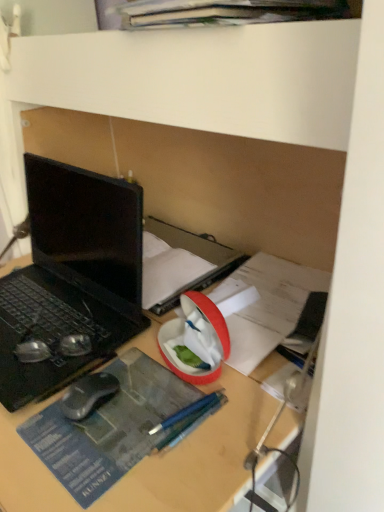
At what (x,y) coordinates should I click in order to perform the action: click on metallic blue pencil at center. Please return your answer as a coordinate pair (x, y). The image size is (384, 512). Looking at the image, I should click on (188, 419).

What is the approximate height of metallic blue pencil at center?

It is 3.09 centimeters.

What do you see at coordinates (194, 255) in the screenshot? This screenshot has width=384, height=512. I see `matte black book at center` at bounding box center [194, 255].

Measure the distance between point (70, 280) and camera.

Point (70, 280) and camera are 93.70 centimeters apart from each other.

Locate an element on the screen. The height and width of the screenshot is (512, 384). black rubberized mouse at lower left is located at coordinates (88, 395).

The width and height of the screenshot is (384, 512). What are the coordinates of `metallic blue pencil at center` in the screenshot? It's located at (188, 419).

From the image's perspective, is matte black book at center on top of black matte laptop at left?

No, from the image's perspective, matte black book at center is not on top of black matte laptop at left.

From a real-world perspective, is matte black book at center physically located above or below black matte laptop at left?

matte black book at center is below black matte laptop at left.

How much distance is there between matte black book at center and black matte laptop at left?

The distance of matte black book at center from black matte laptop at left is 8.84 inches.

Which is closer, (x=161, y=303) or (x=43, y=170)?

Point (x=161, y=303) appears to be closer to the viewer than point (x=43, y=170).

Does black rubberized mouse at lower left have a greater height compared to metallic blue pencil at center?

Indeed, black rubberized mouse at lower left has a greater height compared to metallic blue pencil at center.

Is black rubberized mouse at lower left looking in the opposite direction of metallic blue pencil at center?

No, black rubberized mouse at lower left is not facing the opposite direction of metallic blue pencil at center.

Which point is more distant from viewer, (80, 399) or (201, 421)?

The point (80, 399) is behind.

Do you think metallic blue pencil at center is within black rubberized mouse at lower left, or outside of it?

metallic blue pencil at center is not inside black rubberized mouse at lower left, it's outside.

Is metallic blue pencil at center taller or shorter than black rubberized mouse at lower left?

Considering their sizes, metallic blue pencil at center has less height than black rubberized mouse at lower left.

In terms of width, does metallic blue pencil at center look wider or thinner when compared to black rubberized mouse at lower left?

Clearly, metallic blue pencil at center has more width compared to black rubberized mouse at lower left.

Considering the points (194, 420) and (89, 386), which point is in front, point (194, 420) or point (89, 386)?

The point (194, 420) is more forward.

Is black matte laptop at left inside or outside of matte black book at center?

black matte laptop at left is not enclosed by matte black book at center.

Is black matte laptop at left oriented towards matte black book at center?

No, black matte laptop at left does not turn towards matte black book at center.

Is black matte laptop at left further to the viewer compared to matte black book at center?

No, black matte laptop at left is in front of matte black book at center.

In the scene shown: Considering the relative sizes of black matte laptop at left and matte black book at center in the image provided, is black matte laptop at left shorter than matte black book at center?

No.

Considering the relative sizes of black matte laptop at left and metallic blue pencil at center in the image provided, is black matte laptop at left taller than metallic blue pencil at center?

Indeed, black matte laptop at left has a greater height compared to metallic blue pencil at center.

Does black matte laptop at left have a smaller size compared to metallic blue pencil at center?

Incorrect, black matte laptop at left is not smaller in size than metallic blue pencil at center.

In the scene shown: Based on their positions, is black matte laptop at left located to the left or right of metallic blue pencil at center?

Based on their positions, black matte laptop at left is located to the left of metallic blue pencil at center.

Identify the location of pencil below the black matte laptop at left (from a real-world perspective). The image size is (384, 512). (188, 419).

Considering the relative positions of metallic blue pencil at center and black matte laptop at left in the image provided, is metallic blue pencil at center to the left of black matte laptop at left from the viewer's perspective?

No.

Is metallic blue pencil at center taller than black matte laptop at left?

Incorrect, the height of metallic blue pencil at center is not larger of that of black matte laptop at left.

Identify the location of laptop above the metallic blue pencil at center (from a real-world perspective). This screenshot has height=512, width=384. (72, 277).

How many degrees apart are the facing directions of matte black book at center and black rubberized mouse at lower left?

5.43 degrees separate the facing orientations of matte black book at center and black rubberized mouse at lower left.

Is matte black book at center at the right side of black rubberized mouse at lower left?

Yes.

Is matte black book at center oriented away from black rubberized mouse at lower left?

No.

Considering the relative sizes of matte black book at center and black rubberized mouse at lower left in the image provided, is matte black book at center thinner than black rubberized mouse at lower left?

Incorrect, the width of matte black book at center is not less than that of black rubberized mouse at lower left.

At what (x,y) coordinates should I click in order to perform the action: click on book that is under the black matte laptop at left (from a real-world perspective). Please return your answer as a coordinate pair (x, y). This screenshot has width=384, height=512. Looking at the image, I should click on (194, 255).

Where is `mouse behind the metallic blue pencil at center`? This screenshot has height=512, width=384. mouse behind the metallic blue pencil at center is located at coordinates (88, 395).

Estimate the real-world distances between objects in this image. Which object is closer to matte black book at center, black matte laptop at left or black rubberized mouse at lower left?

black matte laptop at left is positioned closer to the anchor matte black book at center.

Consider the image. Estimate the real-world distances between objects in this image. Which object is closer to metallic blue pencil at center, black matte laptop at left or black rubberized mouse at lower left?

Among the two, black rubberized mouse at lower left is located nearer to metallic blue pencil at center.

From the image, which object appears to be farther from metallic blue pencil at center, black matte laptop at left or matte black book at center?

matte black book at center.

When comparing their distances from matte black book at center, does metallic blue pencil at center or black rubberized mouse at lower left seem further?

metallic blue pencil at center lies further to matte black book at center than the other object.

Looking at the image, which one is located closer to black matte laptop at left, matte black book at center or metallic blue pencil at center?

matte black book at center.

Based on their spatial positions, is matte black book at center or black matte laptop at left further from black rubberized mouse at lower left?

Among the two, matte black book at center is located further to black rubberized mouse at lower left.

Looking at the image, which one is located closer to matte black book at center, black rubberized mouse at lower left or black matte laptop at left?

black matte laptop at left.

Looking at the image, which one is located further to black matte laptop at left, metallic blue pencil at center or matte black book at center?

metallic blue pencil at center is further to black matte laptop at left.

At what (x,y) coordinates should I click in order to perform the action: click on pencil positioned between black matte laptop at left and matte black book at center from near to far. Please return your answer as a coordinate pair (x, y). Looking at the image, I should click on (188, 419).

Locate an element on the screen. The width and height of the screenshot is (384, 512). mouse between black matte laptop at left and metallic blue pencil at center is located at coordinates (88, 395).

You are a GUI agent. You are given a task and a screenshot of the screen. Output one action in this format:
    pyautogui.click(x=<x>, y=<y>)
    Task: Click on the mouse between metallic blue pencil at center and matte black book at center in the front-back direction
    
    Given the screenshot: What is the action you would take?
    pyautogui.click(x=88, y=395)

In order to click on mouse between black matte laptop at left and matte black book at center along the z-axis in this screenshot , I will do `click(88, 395)`.